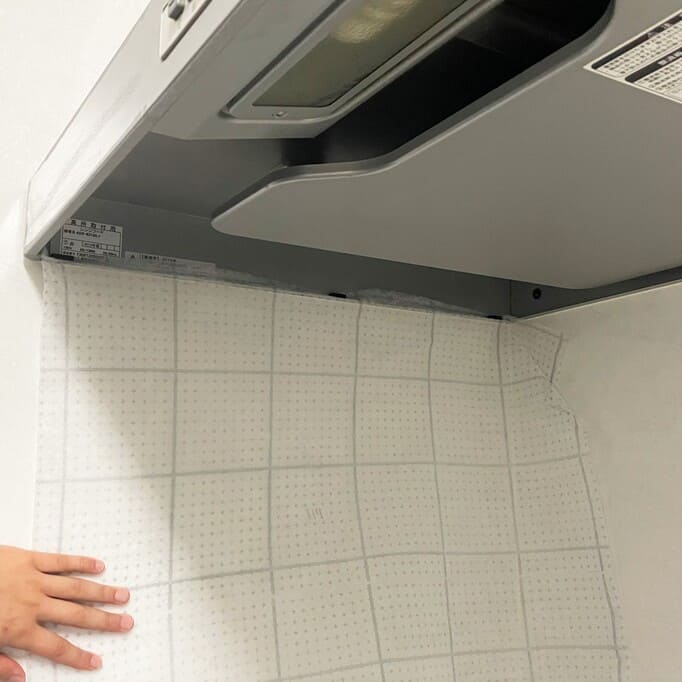
Identify the location of air vent scoop. The image size is (682, 682). (469, 72).